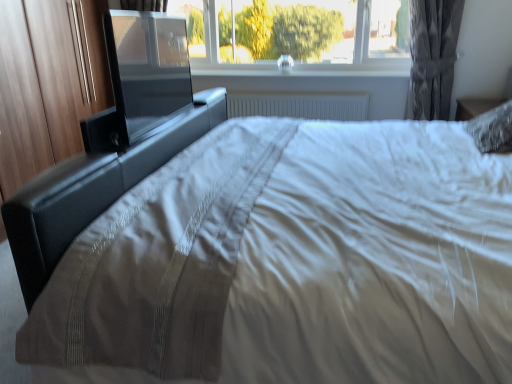
Question: Choose the correct answer: Is black leather bed frame at center inside gray textured curtain at upper right or outside it?

Choices:
 (A) outside
 (B) inside

Answer: (A)

Question: Looking at the image, does black leather bed frame at center seem bigger or smaller compared to gray textured curtain at upper right?

Choices:
 (A) big
 (B) small

Answer: (A)

Question: Which object is the farthest from the gray textured curtain at upper right?

Choices:
 (A) transparent glass window at upper center
 (B) black leather bed frame at center
 (C) black glossy screen door at upper left
 (D) white plastic radiator at center

Answer: (C)

Question: Which object is positioned closest to the black glossy screen door at upper left?

Choices:
 (A) white plastic radiator at center
 (B) transparent glass window at upper center
 (C) black leather bed frame at center
 (D) gray textured curtain at upper right

Answer: (C)